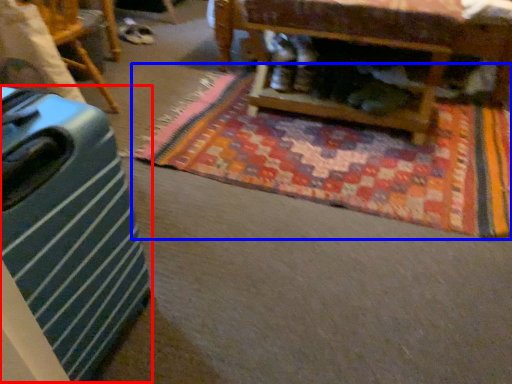
Question: Which object is further to the camera taking this photo, luggage (highlighted by a red box) or mat (highlighted by a blue box)?

Choices:
 (A) luggage
 (B) mat

Answer: (B)